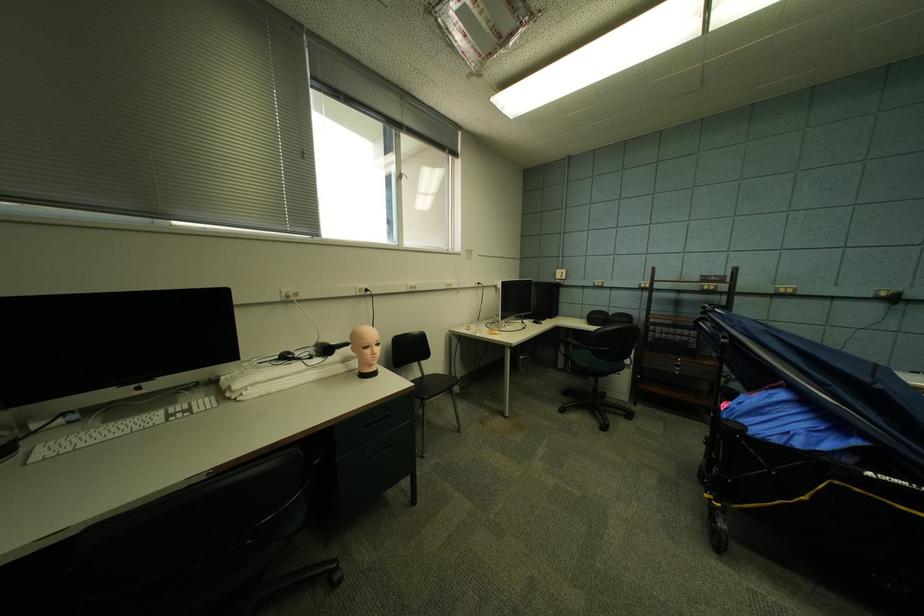
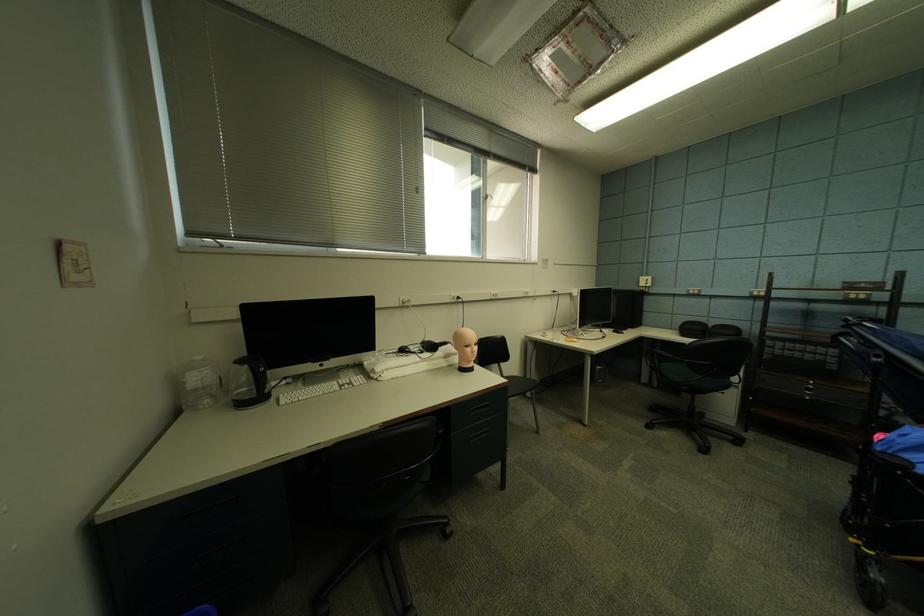
Locate, in the second image, the point that corresponds to pixel 485 286 in the first image.

(561, 294)